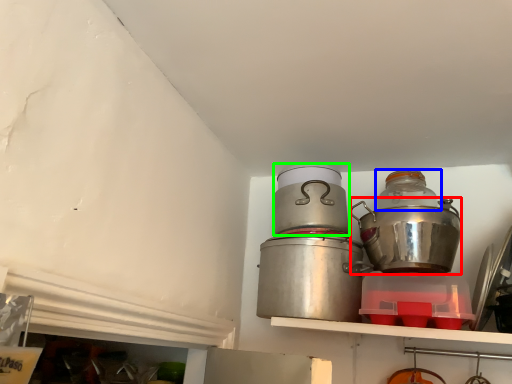
Question: Which object is positioned closest to crock pot (highlighted by a red box)? Select from bottle (highlighted by a blue box) and appliance (highlighted by a green box).

Choices:
 (A) bottle
 (B) appliance

Answer: (A)